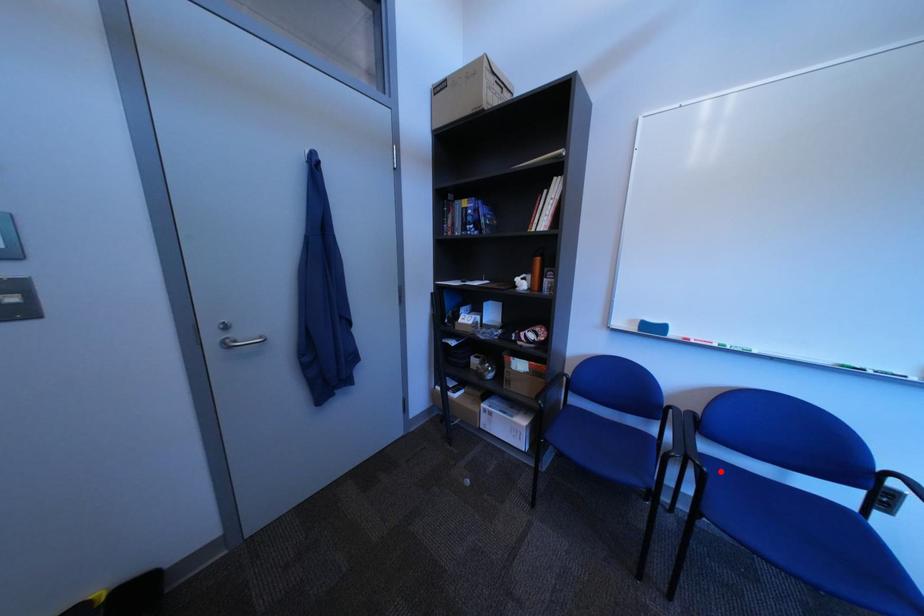
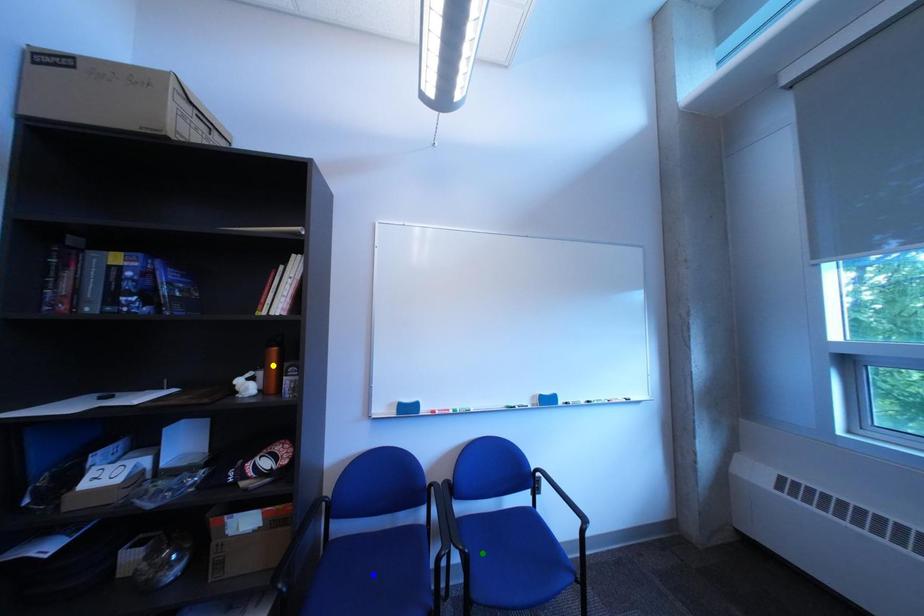
Question: I am providing you with two images of the same scene from different viewpoints. A red point is marked on the first image. You are given multiple points on the second image. Which mark in image 2 goes with the point in image 1?

Choices:
 (A) green point
 (B) yellow point
 (C) blue point

Answer: (A)